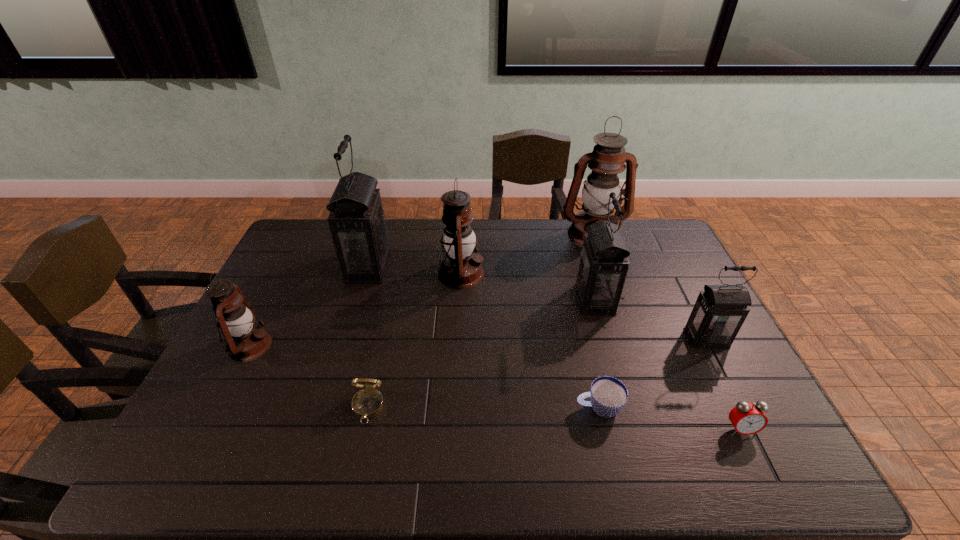
The width and height of the screenshot is (960, 540). In order to click on the leftmost object in this screenshot , I will do `click(246, 341)`.

At what (x,y) coordinates should I click in order to perform the action: click on alarm clock. Please return your answer as a coordinate pair (x, y). The image size is (960, 540). Looking at the image, I should click on (747, 418).

Where is `compass`? The width and height of the screenshot is (960, 540). compass is located at coordinates (x=367, y=403).

Find the location of a particular element. The height and width of the screenshot is (540, 960). blue cup is located at coordinates (608, 395).

Identify the location of cup. This screenshot has width=960, height=540. (608, 395).

This screenshot has width=960, height=540. I want to click on vacant space located 0.370m on the side of the rightmost brown lantern, there is a wick adjustment knob, so click(x=624, y=326).

Where is `vacant space situated 0.200m on the front-facing side of the leftmost gray lantern`? Image resolution: width=960 pixels, height=540 pixels. vacant space situated 0.200m on the front-facing side of the leftmost gray lantern is located at coordinates (448, 267).

You are a GUI agent. You are given a task and a screenshot of the screen. Output one action in this format:
    pyautogui.click(x=<x>, y=<y>)
    Task: Click on the free region located 0.320m on the side of the second brown lantern from right to left, there is a wick adjustment knob
    This screenshot has height=540, width=960.
    Given the screenshot: What is the action you would take?
    pyautogui.click(x=579, y=274)

The width and height of the screenshot is (960, 540). I want to click on vacant area situated on the front-facing side of the second smallest gray lantern, so click(547, 300).

Identify the location of vacant space located on the front-facing side of the second smallest gray lantern. Image resolution: width=960 pixels, height=540 pixels. (550, 300).